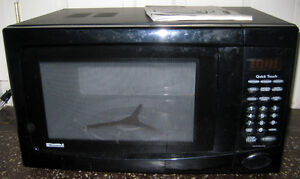
In order to click on led in this screenshot , I will do click(x=265, y=59).